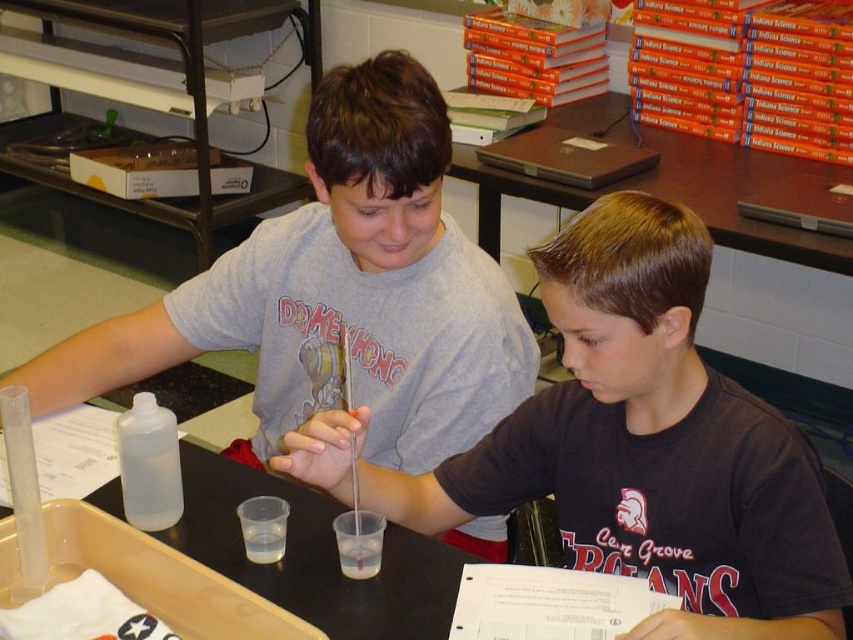
You are a student in this classroom and need to place a textbook on the brown wooden table at upper center. However, there is a gray matte shirt at upper center in the way. Can you move the shirt to make space?

The gray matte shirt at upper center is located below the brown wooden table at upper center, so it is actually underneath the table and not blocking the surface. Therefore, you don not need to move the shirt to place the textbook on the table.

Looking at this image, what are the coordinates of the gray matte shirt at upper center?

The gray matte shirt at upper center is located at coordinates point (339,292).